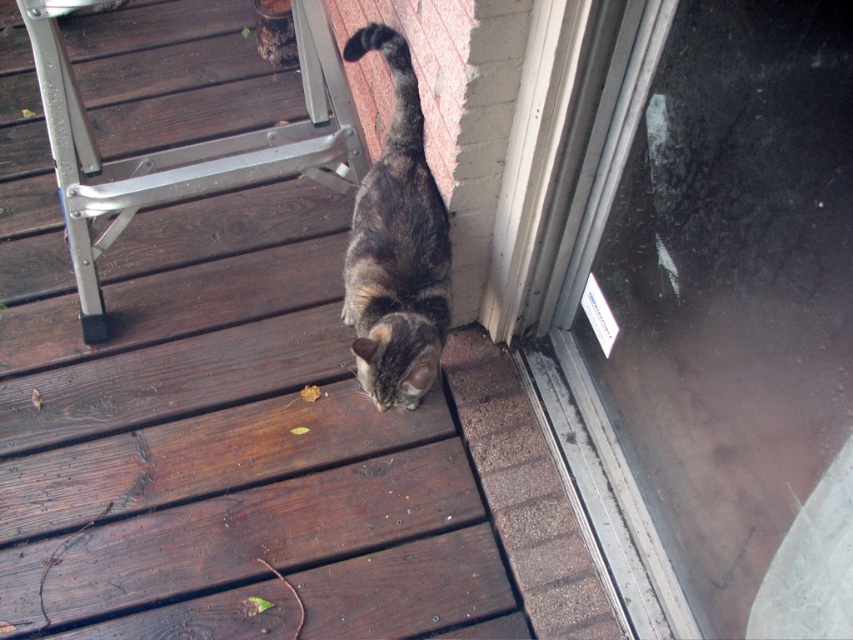
You are a delivery person approaching the transparent glass door at lower right. You notice a tabby fur cat at lower center nearby. Can the cat fit through the door without bending down?

The transparent glass door at lower right is taller than the tabby fur cat at lower center, so the cat can easily pass through the door without bending down.

You are standing on the brown wooden deck at center. What is the coordinate of your current position?

The coordinate of the brown wooden deck at center is point (213, 428).